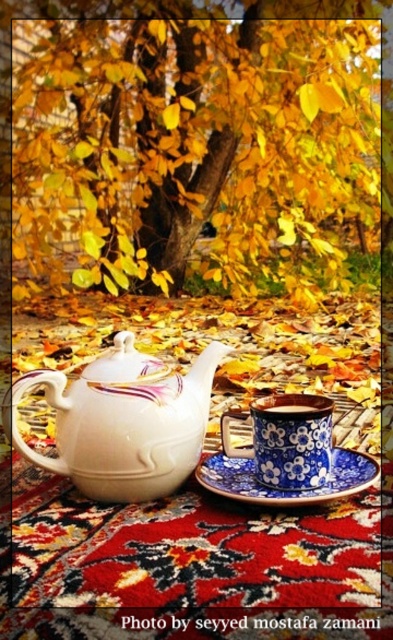
You are taking a photo of the tea set and want to focus on two points in the scene, point (271, 465) and point (279, 403). Which point should you focus on first to ensure the tea set is in sharp focus?

Point (271, 465) is closer to the camera than point (279, 403), so focusing on point (271, 465) first will ensure the tea set is in sharp focus.

You are a tea lover who wants to pour tea from the white glossy teapot at center into the blue floral ceramic cup at center. Considering their sizes, do you think the cup will overflow if you fill it completely?

The white glossy teapot at center is larger than the blue floral ceramic cup at center, so pouring the entire contents of the teapot into the cup may cause it to overflow.

You are standing in front of the tea set on the red patterned rug. The teapot is on the left, and there is a cup at the center. Where exactly is the blue floral ceramic cup at center positioned in relation to the teapot?

The blue floral ceramic cup at center is located at coordinates point (286, 442), which places it to the right of the teapot on the left side of the frame.